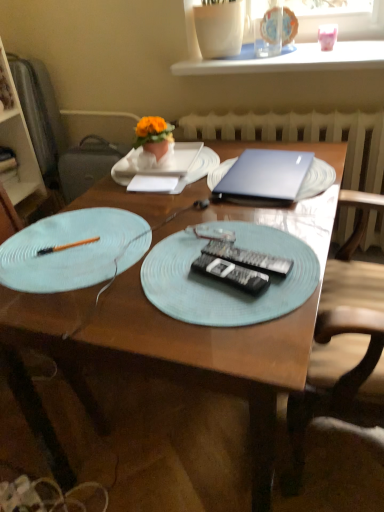
Find the location of `free region under wooden chair at left, positioned as the first chair in left-to-right order (from a real-world perspective)`. free region under wooden chair at left, positioned as the first chair in left-to-right order (from a real-world perspective) is located at coordinates (60, 386).